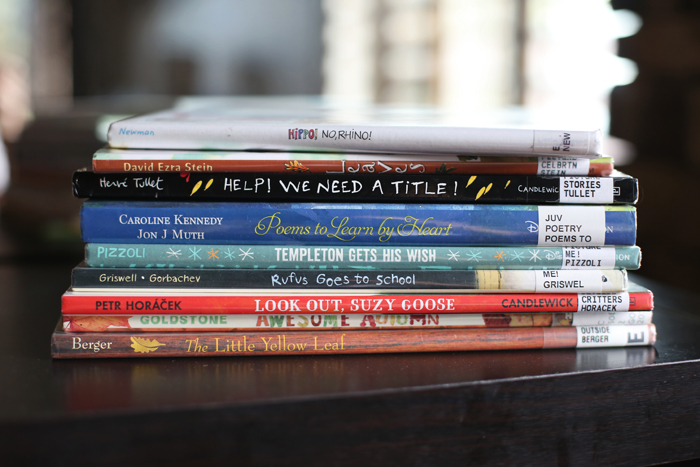
You are a GUI agent. You are given a task and a screenshot of the screen. Output one action in this format:
    pyautogui.click(x=<x>, y=<y>)
    Task: Click on the children's books
    
    Given the screenshot: What is the action you would take?
    pyautogui.click(x=330, y=133), pyautogui.click(x=318, y=168), pyautogui.click(x=318, y=184), pyautogui.click(x=323, y=220), pyautogui.click(x=323, y=255), pyautogui.click(x=325, y=283), pyautogui.click(x=328, y=306), pyautogui.click(x=332, y=322), pyautogui.click(x=332, y=342)